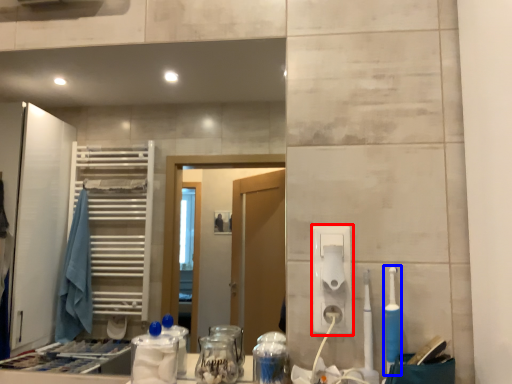
Question: Which object is closer to the camera taking this photo, hand dryer (highlighted by a red box) or toothbrush (highlighted by a blue box)?

Choices:
 (A) hand dryer
 (B) toothbrush

Answer: (B)